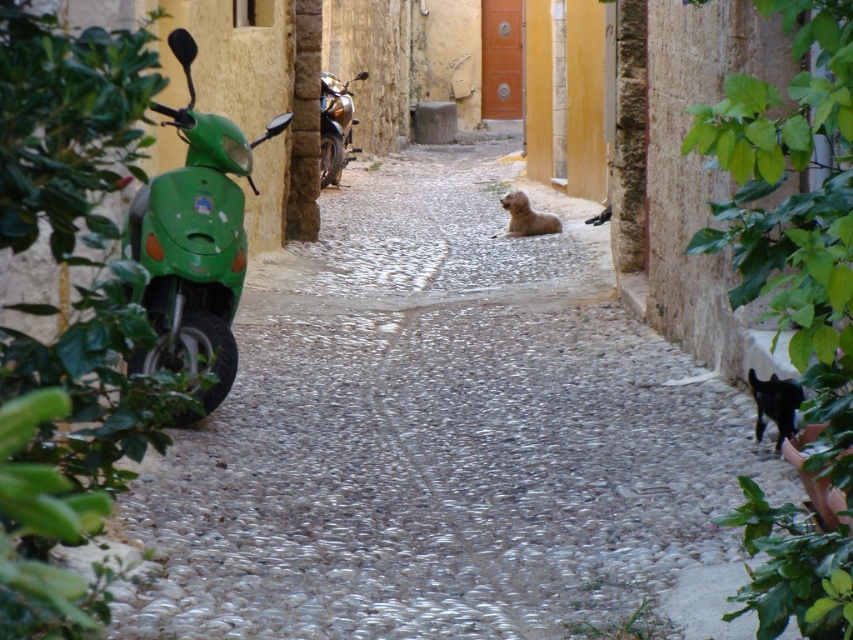
Question: Which point is closer to the camera taking this photo?

Choices:
 (A) (347, 154)
 (B) (781, 403)

Answer: (B)

Question: Does green matte scooter at left have a larger size compared to metallic gold motorcycle at center?

Choices:
 (A) no
 (B) yes

Answer: (B)

Question: Can you confirm if green matte scooter at left is smaller than brown furry dog at center?

Choices:
 (A) yes
 (B) no

Answer: (B)

Question: Which of these objects is positioned farthest from the brown furry dog at center?

Choices:
 (A) green matte scooter at left
 (B) black glossy cat at lower right

Answer: (B)

Question: Estimate the real-world distances between objects in this image. Which object is farther from the green matte scooter at left?

Choices:
 (A) metallic gold motorcycle at center
 (B) black glossy cat at lower right
 (C) brown furry dog at center

Answer: (A)

Question: Is metallic gold motorcycle at center wider than brown furry dog at center?

Choices:
 (A) no
 (B) yes

Answer: (A)